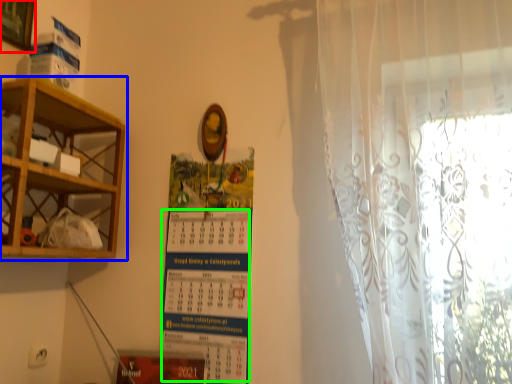
Question: Considering the real-world distances, which object is farthest from picture frame (highlighted by a red box)? shelf (highlighted by a blue box) or writing (highlighted by a green box)?

Choices:
 (A) shelf
 (B) writing

Answer: (B)